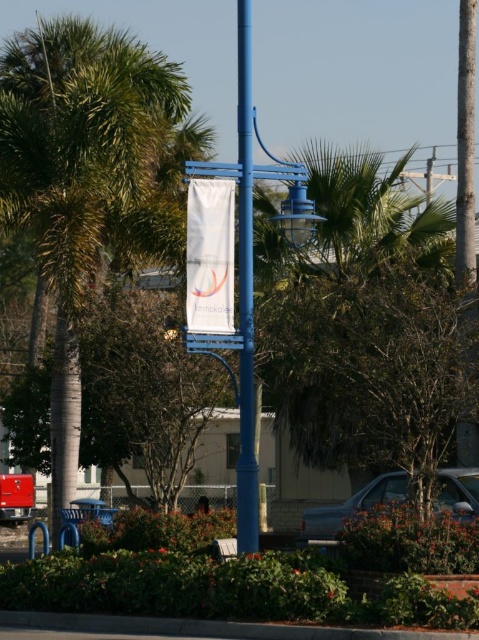
You are standing in front of the blue lamppost and want to hang a new decorative item between the green leafy palm tree at left and the white fabric banner at center. Which object should you place the item closer to if you want it to be positioned to the right of the palm tree?

You should place the item closer to the white fabric banner at center because the green leafy palm tree at left is to the left of the white fabric banner at center, so positioning it closer to the banner would place it to the right of the palm tree.

You are standing at the blue lamppost in the foreground of the image. You see a point marked at coordinates (79,173). Can you identify what object this point is located on?

The point at coordinates (79,173) is located on the green leafy palm tree at left.

You are standing in the outdoor urban scene and want to take a photo of the green leafy palm tree at left and the blue painted metal pole at center. Which object would block your view of the other if you try to frame both in the same shot?

The blue painted metal pole at center would block the view of the green leafy palm tree at left because the palm tree is positioned under the pole, placing the pole in front of it from your perspective.